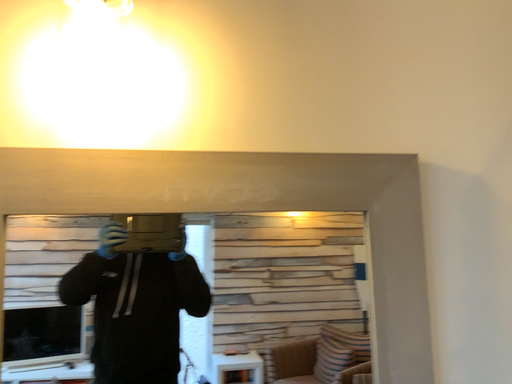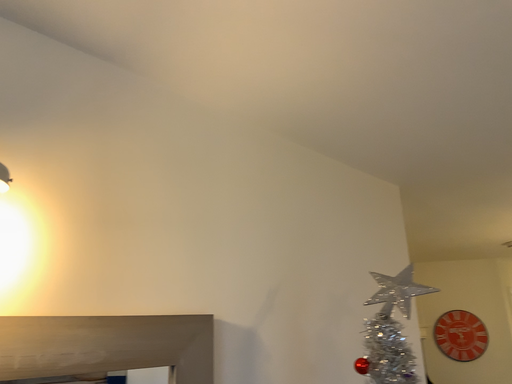
Question: How did the camera likely rotate when shooting the video?

Choices:
 (A) rotated left
 (B) rotated right

Answer: (B)